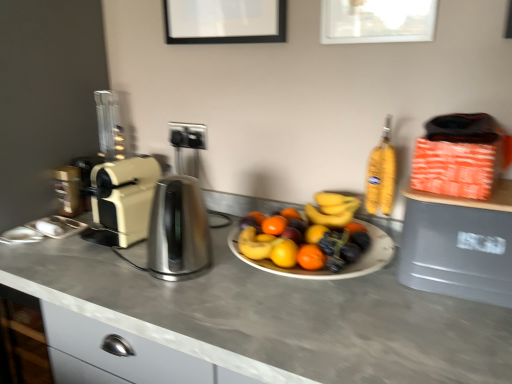
This screenshot has height=384, width=512. Find the location of `free space that is to the left of satin silver kettle at center`. free space that is to the left of satin silver kettle at center is located at coordinates (97, 274).